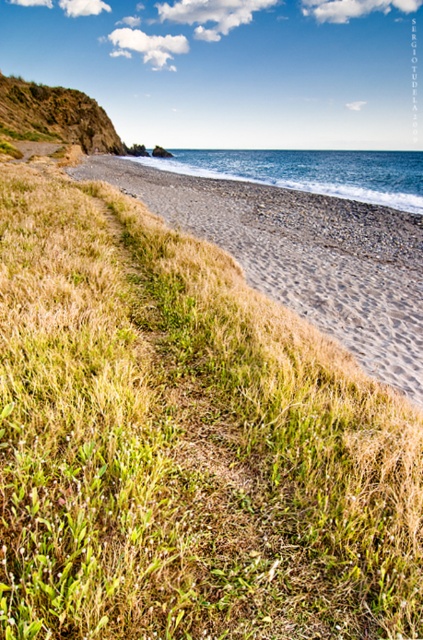
Question: Which of the following is the farthest from the observer?

Choices:
 (A) light brown sandy beach at lower right
 (B) green grassy cliff at upper left
 (C) blue water at beach right

Answer: (B)

Question: Can you confirm if light brown sandy beach at lower right is positioned below blue water at beach right?

Choices:
 (A) no
 (B) yes

Answer: (B)

Question: Is light brown sandy beach at lower right to the right of green grassy cliff at upper left from the viewer's perspective?

Choices:
 (A) yes
 (B) no

Answer: (A)

Question: Does blue water at beach right appear under green grassy cliff at upper left?

Choices:
 (A) yes
 (B) no

Answer: (B)

Question: Among these points, which one is farthest from the camera?

Choices:
 (A) (368, 333)
 (B) (368, 202)

Answer: (B)

Question: Which object is positioned farthest from the light brown sandy beach at lower right?

Choices:
 (A) blue water at beach right
 (B) green grassy cliff at upper left

Answer: (A)